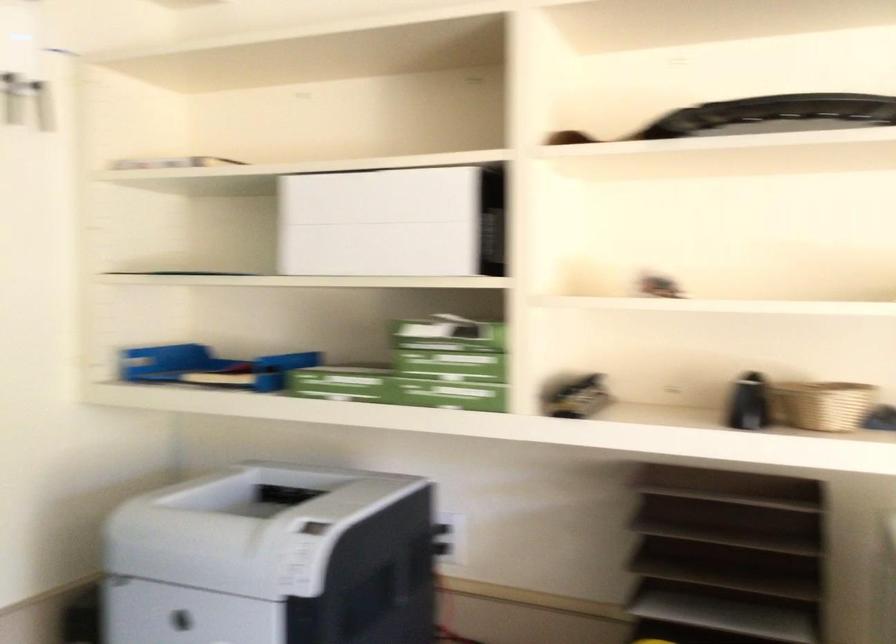
Where is `printer lid`? printer lid is located at coordinates (246, 527).